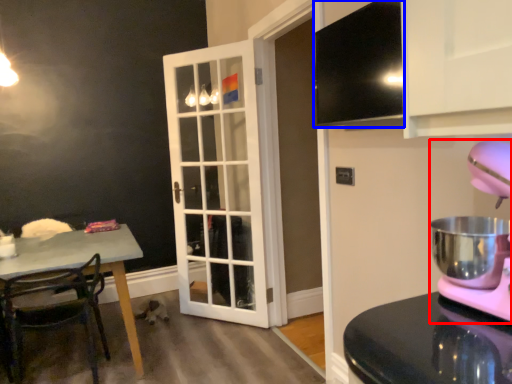
Question: Which of the following is the farthest to the observer, mixer (highlighted by a red box) or exhaust hood (highlighted by a blue box)?

Choices:
 (A) mixer
 (B) exhaust hood

Answer: (B)